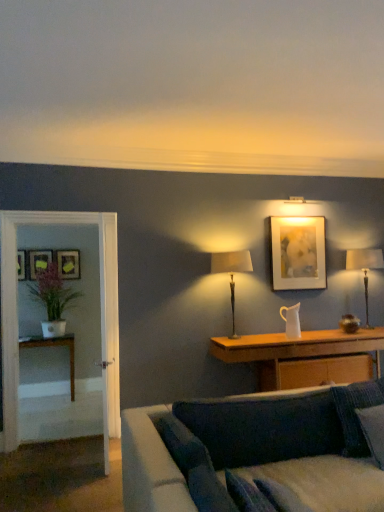
Question: Which direction should I rotate to face wooden cabinet at center, acting as the 2th table starting from the back, — up or down?

Choices:
 (A) down
 (B) up

Answer: (A)

Question: Could you tell me if matte beige lampshade at center, which is counted as the 2th table lamp, starting from the back, is turned towards matte yellow picture frame at left, which is counted as the second picture frame, starting from the back?

Choices:
 (A) no
 (B) yes

Answer: (A)

Question: From the image's perspective, would you say matte beige lampshade at center, the first table lamp viewed from the front, is positioned over matte yellow picture frame at left, marked as the second picture frame in a left-to-right arrangement?

Choices:
 (A) yes
 (B) no

Answer: (B)

Question: Is the depth of matte beige lampshade at center, the first table lamp viewed from the front, greater than that of matte yellow picture frame at left, placed as the 3th picture frame when sorted from right to left?

Choices:
 (A) no
 (B) yes

Answer: (A)

Question: Does matte beige lampshade at center, which is counted as the 1th table lamp, starting from the left, have a lesser height compared to matte yellow picture frame at left, placed as the 3th picture frame when sorted from front to back?

Choices:
 (A) yes
 (B) no

Answer: (B)

Question: Does matte beige lampshade at center, which is counted as the 2th table lamp, starting from the back, have a larger size compared to matte yellow picture frame at left, which is counted as the second picture frame, starting from the back?

Choices:
 (A) no
 (B) yes

Answer: (B)

Question: Considering the relative sizes of matte beige lampshade at center, which is counted as the 1th table lamp, starting from the left, and matte yellow picture frame at left, which is counted as the second picture frame, starting from the back, in the image provided, is matte beige lampshade at center, which is counted as the 1th table lamp, starting from the left, taller than matte yellow picture frame at left, which is counted as the second picture frame, starting from the back,?

Choices:
 (A) no
 (B) yes

Answer: (B)

Question: From the image's perspective, is matte yellow picture frame at left, placed as the 3th picture frame when sorted from right to left, over clear glass door at left?

Choices:
 (A) yes
 (B) no

Answer: (A)

Question: Is clear glass door at left at the back of matte yellow picture frame at left, which is counted as the second picture frame, starting from the back?

Choices:
 (A) no
 (B) yes

Answer: (A)

Question: Could you tell me if matte yellow picture frame at left, placed as the 3th picture frame when sorted from right to left, is facing clear glass door at left?

Choices:
 (A) no
 (B) yes

Answer: (B)

Question: Would you say clear glass door at left is part of matte yellow picture frame at left, marked as the second picture frame in a left-to-right arrangement,'s contents?

Choices:
 (A) yes
 (B) no

Answer: (B)

Question: Can you confirm if matte yellow picture frame at left, placed as the 3th picture frame when sorted from right to left, is smaller than clear glass door at left?

Choices:
 (A) no
 (B) yes

Answer: (B)

Question: Is matte yellow picture frame at left, placed as the 3th picture frame when sorted from right to left, at the right side of clear glass door at left?

Choices:
 (A) no
 (B) yes

Answer: (A)

Question: Does white glossy table at left, acting as the first table starting from the left, have a greater width compared to dark blue fabric pillow at lower right?

Choices:
 (A) yes
 (B) no

Answer: (A)